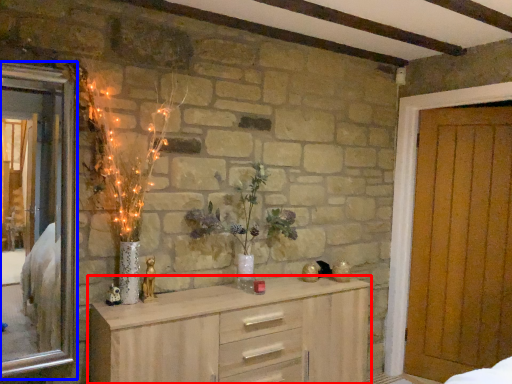
Question: Which object is further to the camera taking this photo, chest of drawers (highlighted by a red box) or window (highlighted by a blue box)?

Choices:
 (A) chest of drawers
 (B) window

Answer: (B)